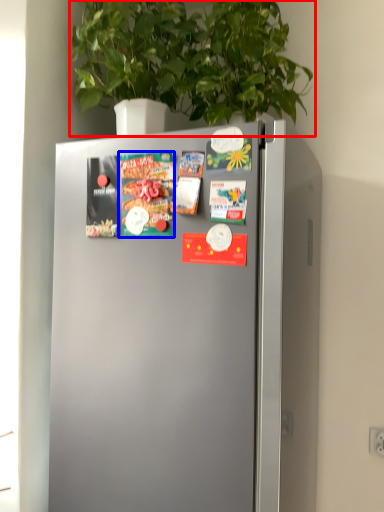
Question: Among these objects, which one is nearest to the camera, houseplant (highlighted by a red box) or magazine (highlighted by a blue box)?

Choices:
 (A) houseplant
 (B) magazine

Answer: (A)